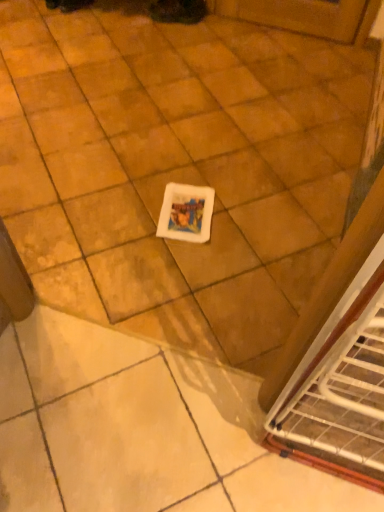
Question: Is matte black shoe at upper center taller or shorter than white matte tile at center?

Choices:
 (A) tall
 (B) short

Answer: (A)

Question: Looking at their shapes, would you say matte black shoe at upper center is wider or thinner than white matte tile at center?

Choices:
 (A) thin
 (B) wide

Answer: (A)

Question: Is matte black shoe at upper center inside the boundaries of white matte tile at center, or outside?

Choices:
 (A) outside
 (B) inside

Answer: (A)

Question: Considering the relative positions of white matte tile at center and matte black shoe at upper center in the image provided, is white matte tile at center to the left or to the right of matte black shoe at upper center?

Choices:
 (A) left
 (B) right

Answer: (A)

Question: In the image, is white matte tile at center positioned in front of or behind matte black shoe at upper center?

Choices:
 (A) behind
 (B) front

Answer: (B)

Question: Is point (130, 226) closer or farther from the camera than point (150, 10)?

Choices:
 (A) closer
 (B) farther

Answer: (A)

Question: From their relative heights in the image, would you say white matte tile at center is taller or shorter than matte black shoe at upper center?

Choices:
 (A) tall
 (B) short

Answer: (B)